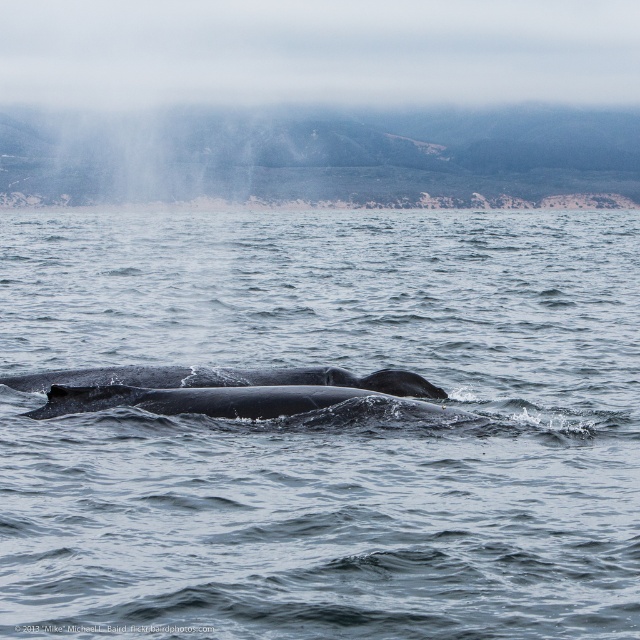
Is gray matte water at center smaller than gray matte whale at center?

Actually, gray matte water at center might be larger than gray matte whale at center.

Is gray matte water at center thinner than gray matte whale at center?

Incorrect, gray matte water at center's width is not less than gray matte whale at center's.

The height and width of the screenshot is (640, 640). I want to click on gray matte water at center, so click(x=326, y=426).

This screenshot has width=640, height=640. I want to click on gray matte water at center, so click(x=326, y=426).